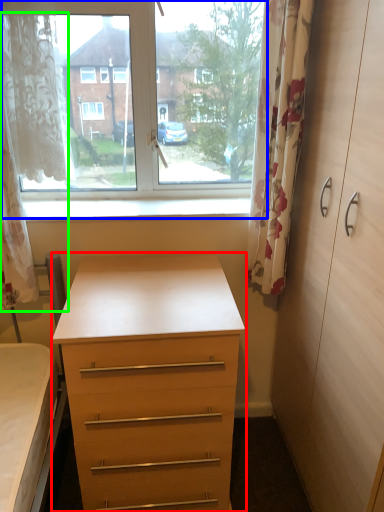
Question: Which is farther away from chest of drawers (highlighted by a red box)? window (highlighted by a blue box) or curtain (highlighted by a green box)?

Choices:
 (A) window
 (B) curtain

Answer: (B)